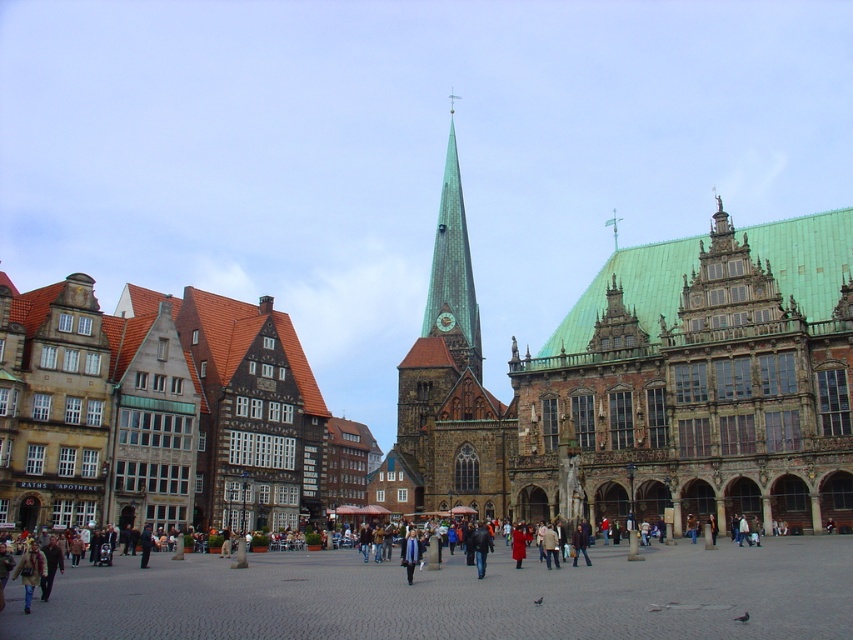
Question: Does green stone church at center appear under blue fabric scarf at center?

Choices:
 (A) yes
 (B) no

Answer: (B)

Question: Can you confirm if green copper spire at center is thinner than blue fabric scarf at center?

Choices:
 (A) no
 (B) yes

Answer: (A)

Question: Which object is positioned farthest from the green copper steeple at center?

Choices:
 (A) green copper spire at center
 (B) brown cobblestone square at center

Answer: (B)

Question: Which point is closer to the camera?

Choices:
 (A) blue fabric scarf at center
 (B) green copper spire at center
 (C) green copper steeple at center

Answer: (A)

Question: Considering the relative positions of brown cobblestone square at center and blue fabric scarf at center in the image provided, where is brown cobblestone square at center located with respect to blue fabric scarf at center?

Choices:
 (A) above
 (B) below

Answer: (A)

Question: Among these points, which one is farthest from the camera?

Choices:
 (A) (409, 547)
 (B) (711, 234)
 (C) (619, 593)

Answer: (B)